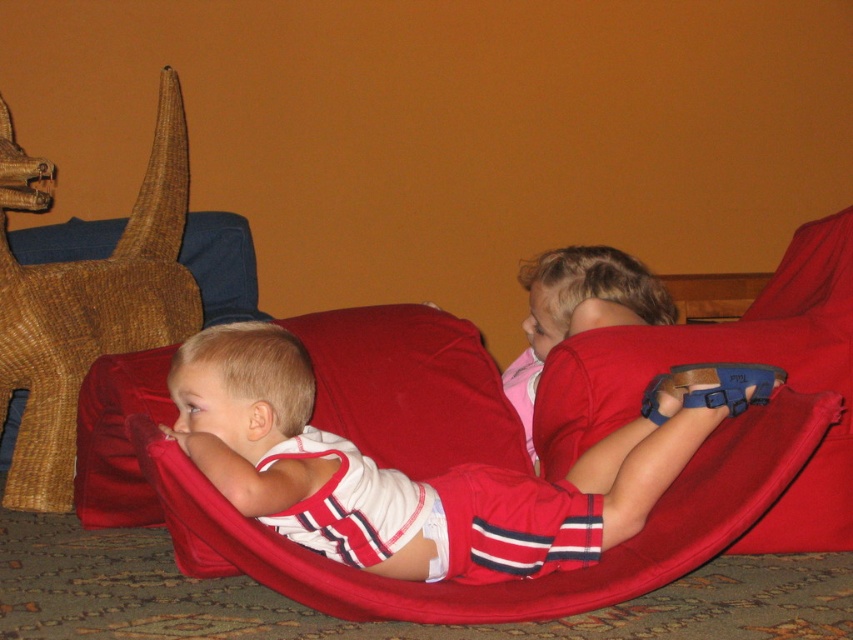
Between point (3, 208) and point (543, 392), which one is positioned in front?

Positioned in front is point (543, 392).

Based on the photo, between woven wicker toy at left and red fabric bean bag at center, which one is positioned higher?

Positioned higher is woven wicker toy at left.

Which is behind, point (119, 301) or point (831, 518)?

Positioned behind is point (119, 301).

At what (x,y) coordinates should I click in order to perform the action: click on woven wicker toy at left. Please return your answer as a coordinate pair (x, y). Looking at the image, I should click on (86, 301).

Is red fabric bean bag at center wider than pink fabric at center?

Indeed, red fabric bean bag at center has a greater width compared to pink fabric at center.

Can you confirm if red fabric bean bag at center is positioned above pink fabric at center?

Actually, red fabric bean bag at center is below pink fabric at center.

Measure the distance between point (628, 419) and camera.

They are 1.94 meters apart.

This screenshot has width=853, height=640. I want to click on red fabric bean bag at center, so click(x=729, y=360).

Based on the photo, which of these two, white striped fabric at center or woven wicker toy at left, stands shorter?

white striped fabric at center is shorter.

Is white striped fabric at center positioned before woven wicker toy at left?

Yes, it is in front of woven wicker toy at left.

Which is in front, point (506, 576) or point (177, 282)?

Point (506, 576)

I want to click on white striped fabric at center, so click(x=299, y=456).